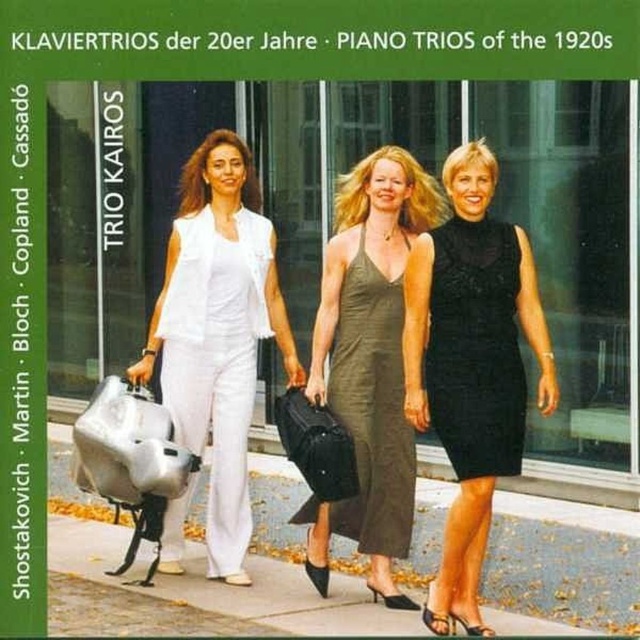
Question: Which of the following is the farthest from the observer?

Choices:
 (A) black lace dress at center
 (B) gray concrete pavement at center
 (C) matte olive green dress at center

Answer: (C)

Question: Which point is farther to the camera?

Choices:
 (A) (605, 570)
 (B) (454, 385)

Answer: (A)

Question: Does gray concrete pavement at center appear on the right side of black lace dress at right?

Choices:
 (A) no
 (B) yes

Answer: (B)

Question: From the image, what is the correct spatial relationship of black lace dress at center in relation to black lace dress at right?

Choices:
 (A) below
 (B) above

Answer: (A)

Question: Which of the following is the closest to the observer?

Choices:
 (A) (328, 371)
 (B) (266, 476)
 (C) (461, 468)
 (D) (452, 326)

Answer: (C)

Question: Does black lace dress at center have a greater width compared to black lace dress at right?

Choices:
 (A) yes
 (B) no

Answer: (A)